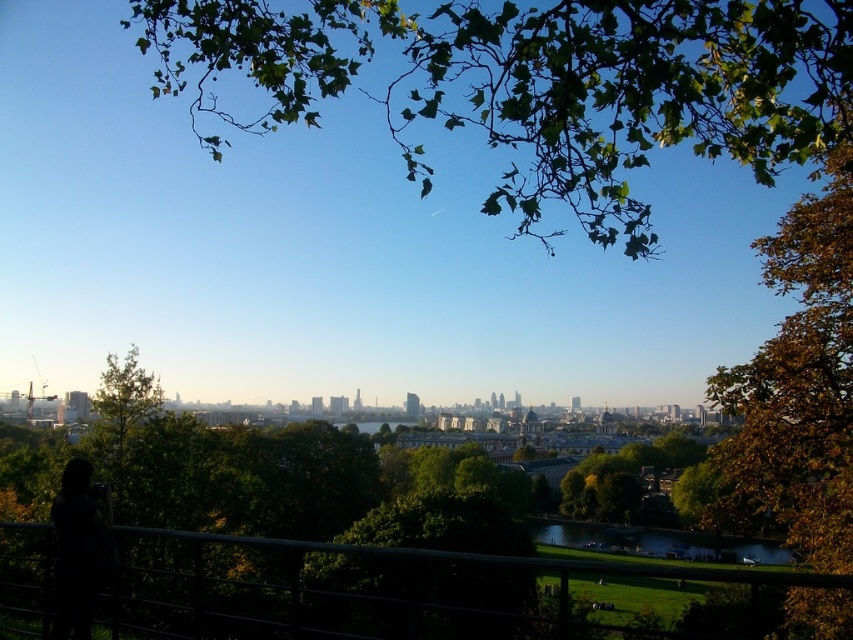
Question: Considering the real-world distances, which object is farthest from the green leafy branch at upper center?

Choices:
 (A) black metal fence at lower center
 (B) black matte person at lower left
 (C) brown leafy tree at right

Answer: (B)

Question: Does green leafy branch at upper center have a greater width compared to brown leafy tree at right?

Choices:
 (A) yes
 (B) no

Answer: (A)

Question: Does brown leafy tree at right appear under black matte person at lower left?

Choices:
 (A) yes
 (B) no

Answer: (B)

Question: Which point is closer to the camera?

Choices:
 (A) (450, 1)
 (B) (796, 433)

Answer: (B)

Question: In this image, where is green leafy branch at upper center located relative to black matte person at lower left?

Choices:
 (A) above
 (B) below

Answer: (A)

Question: Which is farther from the black matte person at lower left?

Choices:
 (A) green leafy branch at upper center
 (B) black metal fence at lower center

Answer: (A)